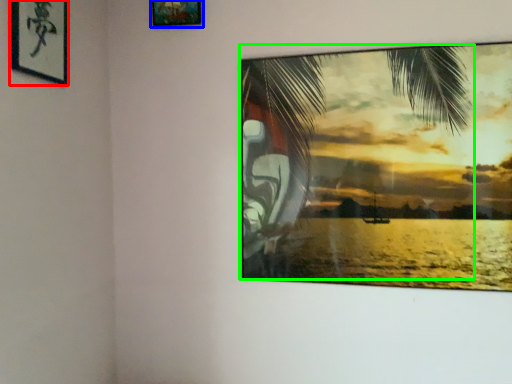
Question: Considering the real-world distances, which object is farthest from picture frame (highlighted by a red box)? picture frame (highlighted by a blue box) or palm tree (highlighted by a green box)?

Choices:
 (A) picture frame
 (B) palm tree

Answer: (B)